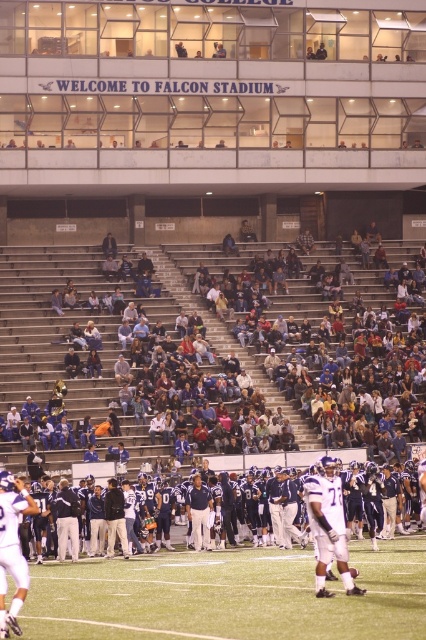
You are a spectator sitting in the blue fabric seats at center. You want to watch the football game happening on the green turf at center. Which direction should you look to see the game?

The green turf at center is behind the blue fabric seats at center, so you should look behind you to see the game.